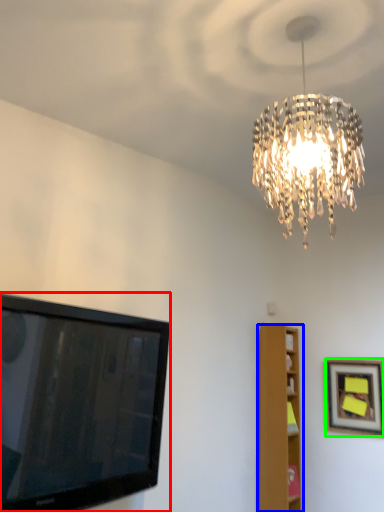
Question: Based on their relative distances, which object is farther from television (highlighted by a red box)? Choose from furniture (highlighted by a blue box) and picture frame (highlighted by a green box).

Choices:
 (A) furniture
 (B) picture frame

Answer: (B)